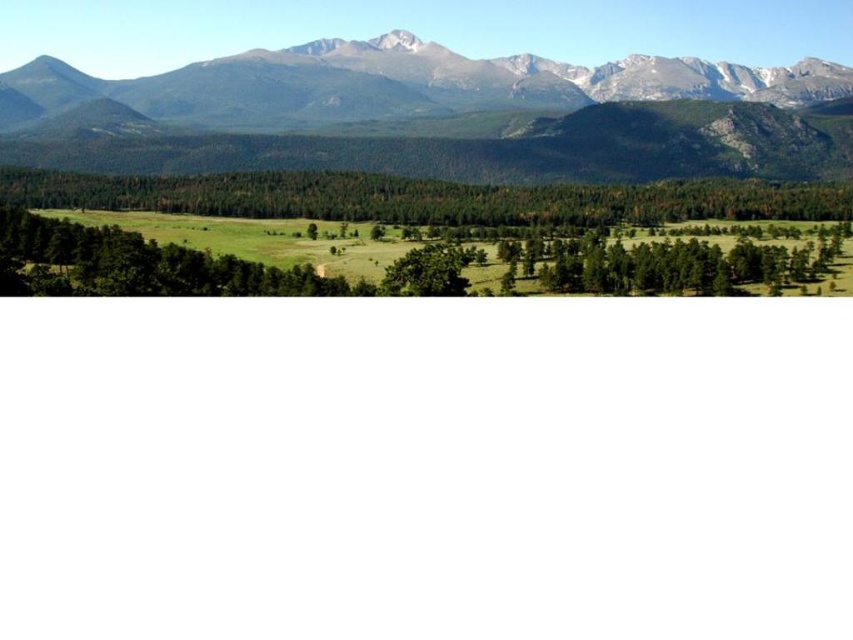
Question: Which of the following is the closest to the observer?

Choices:
 (A) (35, 180)
 (B) (416, 282)

Answer: (B)

Question: Which object is farther from the camera taking this photo?

Choices:
 (A) green matte forest at center
 (B) rocky gray mountain range at upper center
 (C) green matte tree at center

Answer: (B)

Question: Where is rocky gray mountain range at upper center located in relation to green matte tree at center in the image?

Choices:
 (A) right
 (B) left

Answer: (B)

Question: Can you confirm if green matte forest at center is bigger than green matte tree at center?

Choices:
 (A) no
 (B) yes

Answer: (B)

Question: Is green matte forest at center to the right of green matte tree at center from the viewer's perspective?

Choices:
 (A) yes
 (B) no

Answer: (A)

Question: Estimate the real-world distances between objects in this image. Which object is closer to the rocky gray mountain range at upper center?

Choices:
 (A) green matte tree at center
 (B) green matte forest at center

Answer: (B)